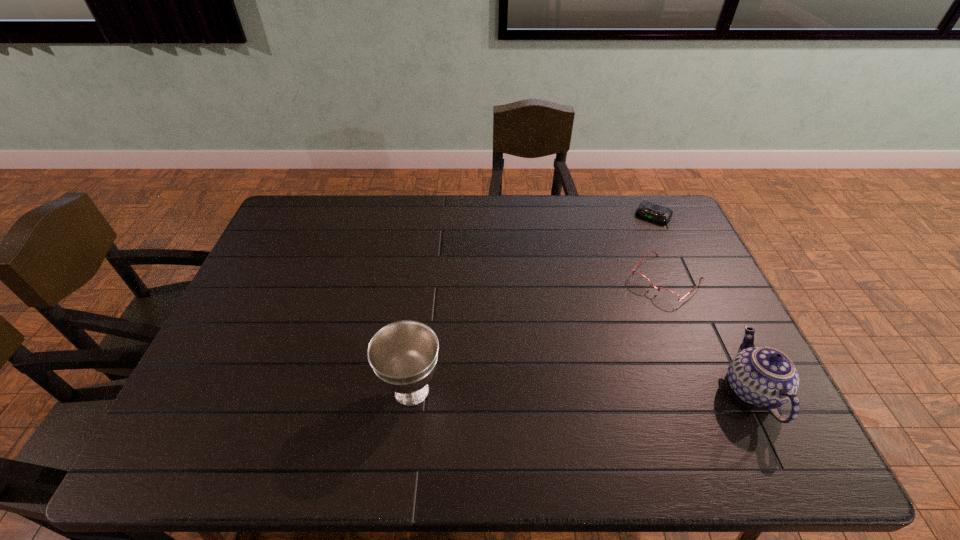
This screenshot has height=540, width=960. I want to click on the leftmost object, so click(403, 354).

Image resolution: width=960 pixels, height=540 pixels. In order to click on chalice in this screenshot , I will do `click(403, 354)`.

In order to click on the third shortest object in this screenshot , I will do `click(765, 377)`.

I want to click on the shortest object, so click(x=659, y=214).

Locate an element on the screen. the farthest object is located at coordinates (659, 214).

Where is `the third tallest object`? This screenshot has width=960, height=540. the third tallest object is located at coordinates (640, 278).

Image resolution: width=960 pixels, height=540 pixels. What are the coordinates of `the second farthest object` in the screenshot? It's located at (640, 278).

Where is `vacant point located 0.250m on the left of the leftmost object`? Image resolution: width=960 pixels, height=540 pixels. vacant point located 0.250m on the left of the leftmost object is located at coordinates (x=279, y=391).

Where is `free location located 0.340m on the display of the alarm clock`? free location located 0.340m on the display of the alarm clock is located at coordinates coord(612,282).

The width and height of the screenshot is (960, 540). I want to click on free space located 0.120m on the display of the alarm clock, so click(636, 242).